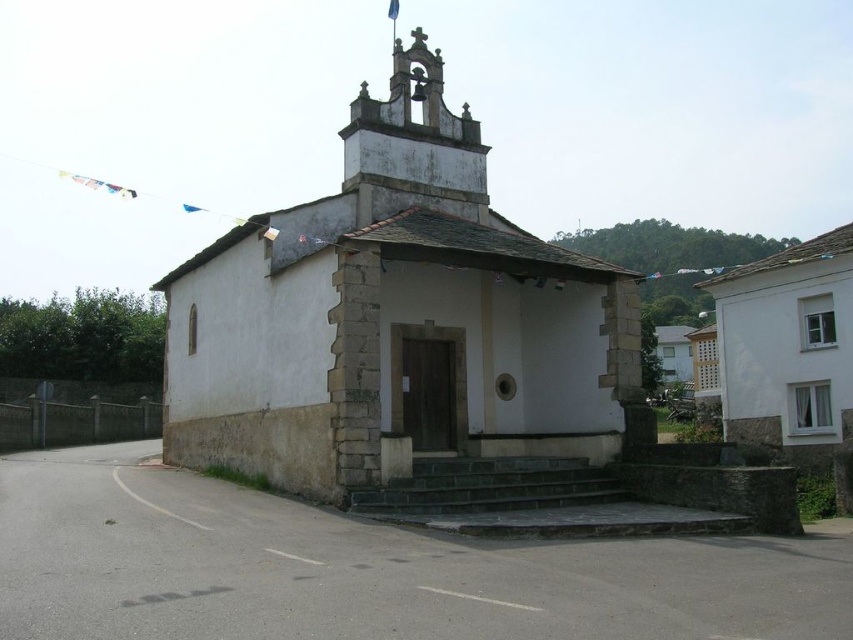
Question: Can you confirm if white stone chapel at center is smaller than dark gray stone stairs at center?

Choices:
 (A) no
 (B) yes

Answer: (A)

Question: Is white stone chapel at center bigger than dark gray stone stairs at center?

Choices:
 (A) no
 (B) yes

Answer: (B)

Question: From the image, what is the correct spatial relationship of white stone chapel at center in relation to dark gray stone stairs at center?

Choices:
 (A) left
 (B) right

Answer: (A)